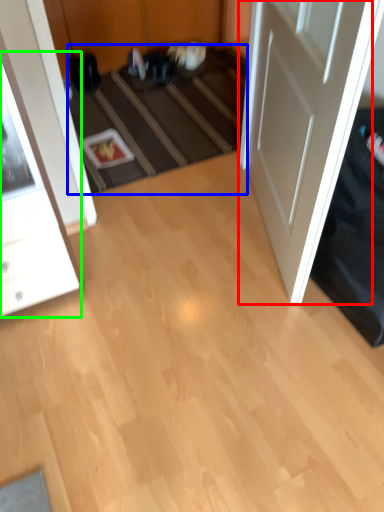
Question: Which object is the farthest from door (highlighted by a red box)? Choose among these: stair (highlighted by a blue box) or cabinetry (highlighted by a green box).

Choices:
 (A) stair
 (B) cabinetry

Answer: (B)